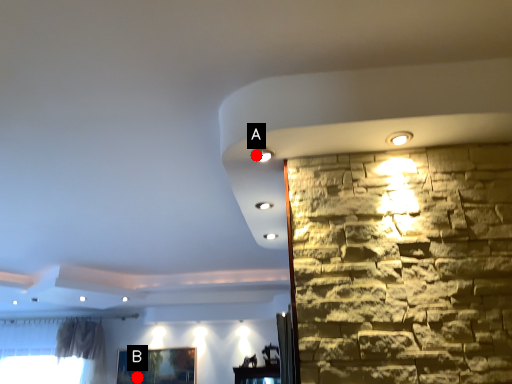
Question: Two points are circled on the image, labeled by A and B beside each circle. Among these points, which one is farthest from the camera?

Choices:
 (A) A is further
 (B) B is further

Answer: (B)